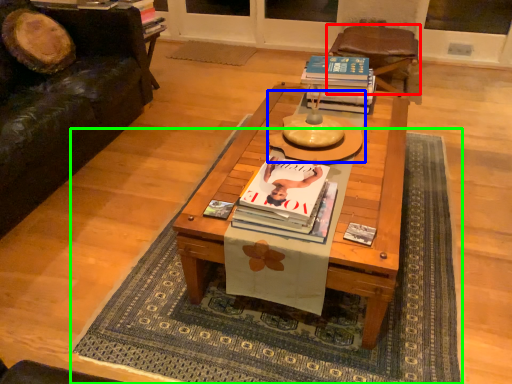
Question: Which object is positioned farthest from chair (highlighted by a red box)? Select from round table (highlighted by a blue box) and mat (highlighted by a green box).

Choices:
 (A) round table
 (B) mat

Answer: (A)